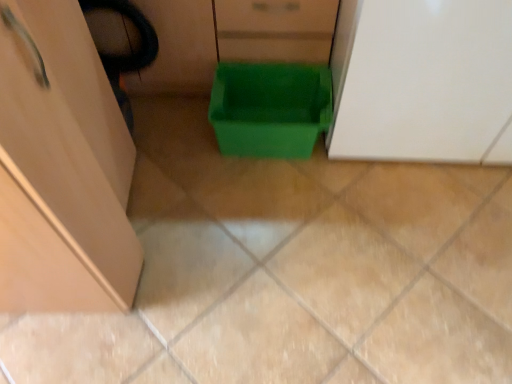
Question: From a real-world perspective, is green plastic bin at center above or below white glossy cabinet at upper right?

Choices:
 (A) above
 (B) below

Answer: (B)

Question: In terms of size, does green plastic bin at center appear bigger or smaller than white glossy cabinet at upper right?

Choices:
 (A) small
 (B) big

Answer: (A)

Question: Do you think green plastic bin at center is within white glossy cabinet at upper right, or outside of it?

Choices:
 (A) inside
 (B) outside

Answer: (B)

Question: Is white glossy cabinet at upper right taller or shorter than green plastic bin at center?

Choices:
 (A) short
 (B) tall

Answer: (B)

Question: In terms of size, does white glossy cabinet at upper right appear bigger or smaller than green plastic bin at center?

Choices:
 (A) small
 (B) big

Answer: (B)

Question: Does point (377, 43) appear closer or farther from the camera than point (318, 67)?

Choices:
 (A) closer
 (B) farther

Answer: (A)

Question: In terms of width, does white glossy cabinet at upper right look wider or thinner when compared to green plastic bin at center?

Choices:
 (A) thin
 (B) wide

Answer: (B)